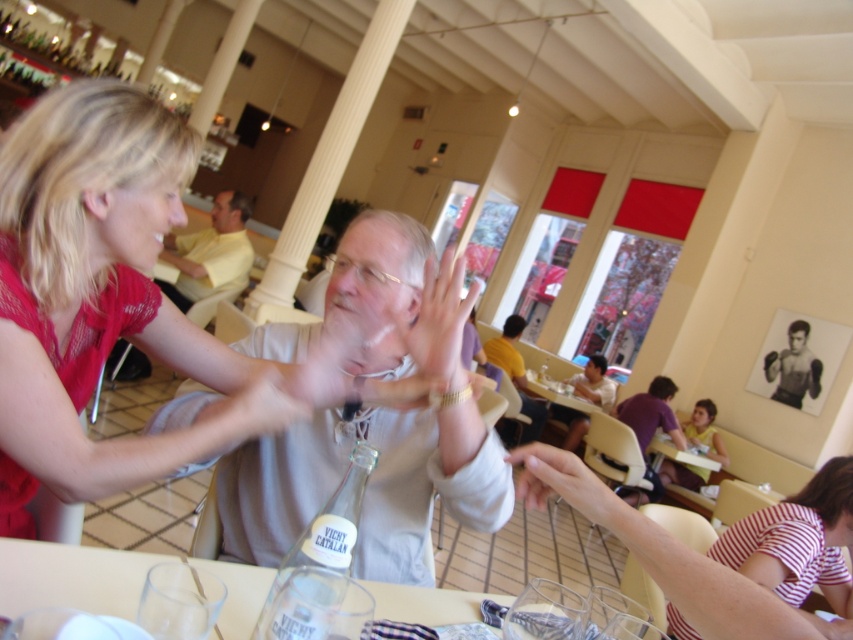
You are a photographer taking a picture of the scene. The matte pink blouse at upper left and the smooth white hand at center are in your frame. Based on their positions, which object should you focus on first to ensure both are in focus?

The matte pink blouse at upper left should be focused on first since it is positioned above the smooth white hand at center, allowing the depth of field to capture both objects in focus.

You are a photographer trying to capture a candid shot of the two people in the scene. The camera you are using has a minimum focusing distance of 24 inches. Can you take a clear photo of both the matte pink blouse at upper left and the smooth white hand at center without moving the camera?

The matte pink blouse at upper left and smooth white hand at center are 26.75 inches apart, which is beyond the camera minimum focusing distance of 24 inches. Therefore, you can take a clear photo of both without moving the camera.